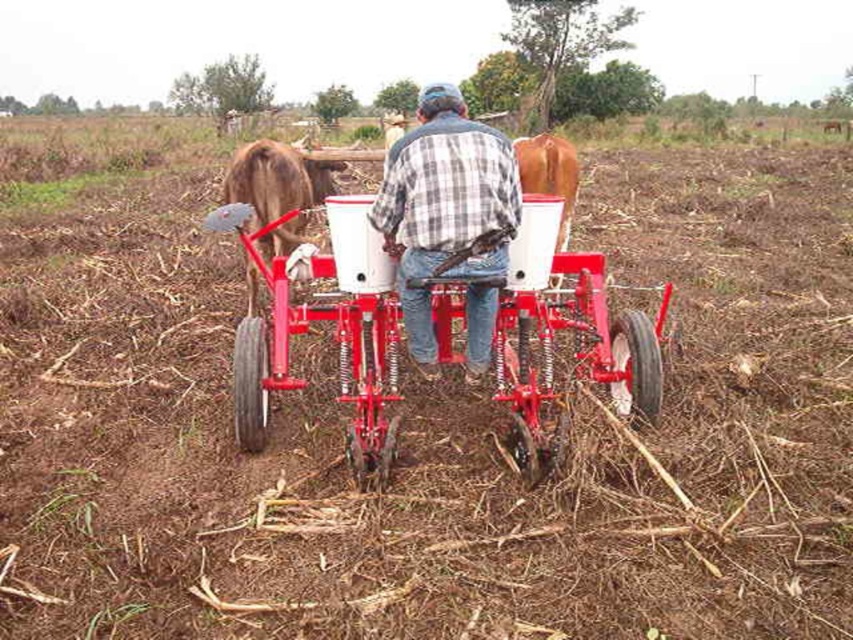
Does plaid cotton shirt at center appear on the left side of brown matte bull at left?

Incorrect, plaid cotton shirt at center is not on the left side of brown matte bull at left.

Who is more distant from viewer, (474, 220) or (244, 269)?

The point (244, 269) is behind.

Where is `plaid cotton shirt at center`? This screenshot has height=640, width=853. plaid cotton shirt at center is located at coordinates (444, 204).

Image resolution: width=853 pixels, height=640 pixels. I want to click on plaid cotton shirt at center, so click(x=444, y=204).

Is metallic red plow at center below plaid cotton shirt at center?

Indeed, metallic red plow at center is positioned under plaid cotton shirt at center.

Is metallic red plow at center to the left of plaid cotton shirt at center from the viewer's perspective?

Incorrect, metallic red plow at center is not on the left side of plaid cotton shirt at center.

Which is in front, point (512, 420) or point (421, 140)?

Positioned in front is point (421, 140).

Where is `metallic red plow at center`? metallic red plow at center is located at coordinates (573, 342).

From the picture: Between metallic red plow at center and brown matte bull at left, which one has more height?

brown matte bull at left is taller.

Looking at this image, which is below, metallic red plow at center or brown matte bull at left?

metallic red plow at center

The width and height of the screenshot is (853, 640). Describe the element at coordinates (573, 342) in the screenshot. I see `metallic red plow at center` at that location.

I want to click on metallic red plow at center, so click(573, 342).